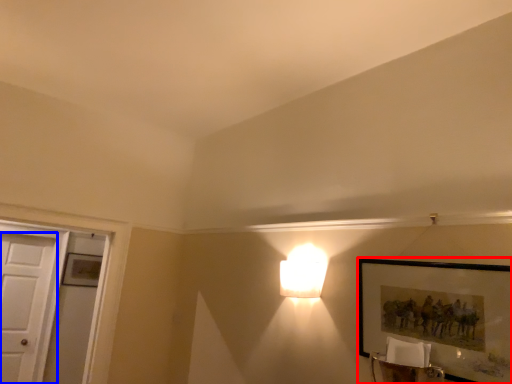
Question: Which of the following is the farthest to the observer, picture frame (highlighted by a red box) or door (highlighted by a blue box)?

Choices:
 (A) picture frame
 (B) door

Answer: (B)